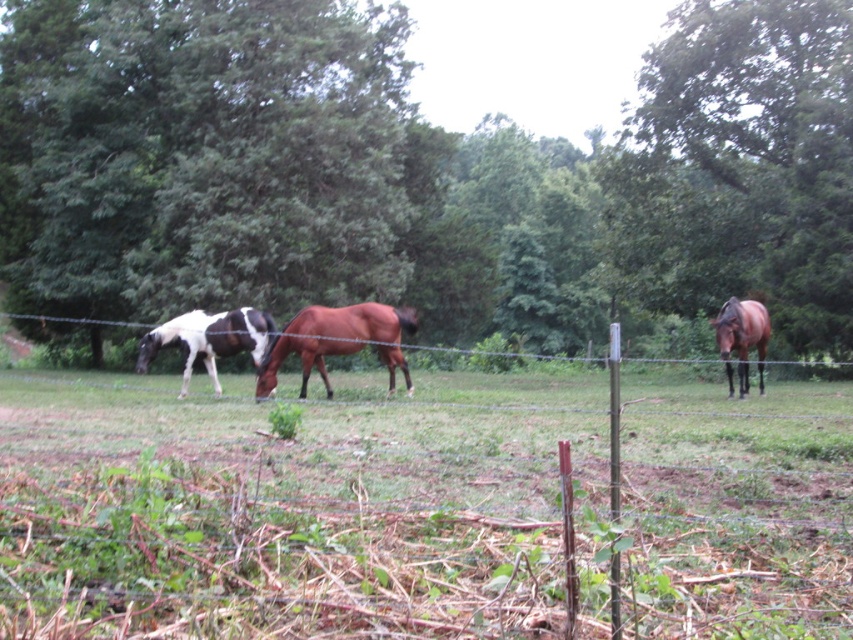
Does green leafy tree at upper center have a larger size compared to brown glossy horse at right?

Indeed, green leafy tree at upper center has a larger size compared to brown glossy horse at right.

Is point (572, 276) closer to viewer compared to point (729, 307)?

No, (572, 276) is further to viewer.

Which is in front, point (67, 8) or point (756, 336)?

Point (756, 336) is more forward.

Where is `green leafy tree at upper center`? This screenshot has width=853, height=640. green leafy tree at upper center is located at coordinates (419, 173).

Which is below, brown glossy horse at center or brown glossy horse at right?

brown glossy horse at right is below.

The image size is (853, 640). In order to click on brown glossy horse at center in this screenshot , I will do `click(337, 340)`.

The image size is (853, 640). Find the location of `brown glossy horse at center`. brown glossy horse at center is located at coordinates (337, 340).

Is the position of green leafy tree at upper left less distant than that of brown glossy horse at right?

No.

Can you confirm if green leafy tree at upper left is shorter than brown glossy horse at right?

No.

Is point (363, 65) less distant than point (730, 305)?

No, (363, 65) is behind (730, 305).

The image size is (853, 640). I want to click on green leafy tree at upper left, so [x=207, y=150].